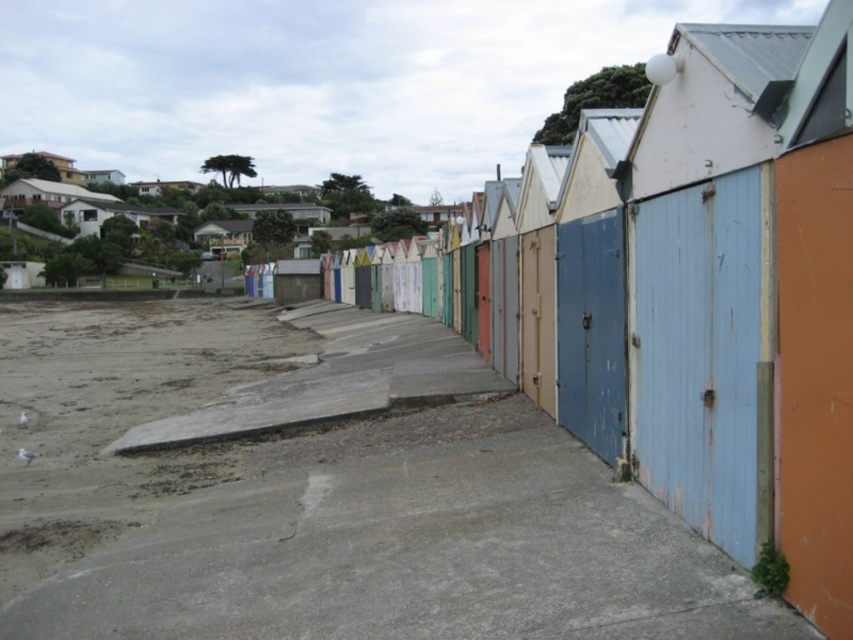
Question: Is smooth concrete walkway at center further to the viewer compared to gray sandy beach at lower left?

Choices:
 (A) no
 (B) yes

Answer: (A)

Question: Which of the following is the farthest from the observer?

Choices:
 (A) smooth concrete walkway at center
 (B) gray sandy beach at lower left

Answer: (B)

Question: Among these points, which one is farthest from the camera?

Choices:
 (A) (78, 456)
 (B) (337, 484)

Answer: (A)

Question: Is smooth concrete walkway at center in front of gray sandy beach at lower left?

Choices:
 (A) no
 (B) yes

Answer: (B)

Question: Is smooth concrete walkway at center smaller than gray sandy beach at lower left?

Choices:
 (A) no
 (B) yes

Answer: (B)